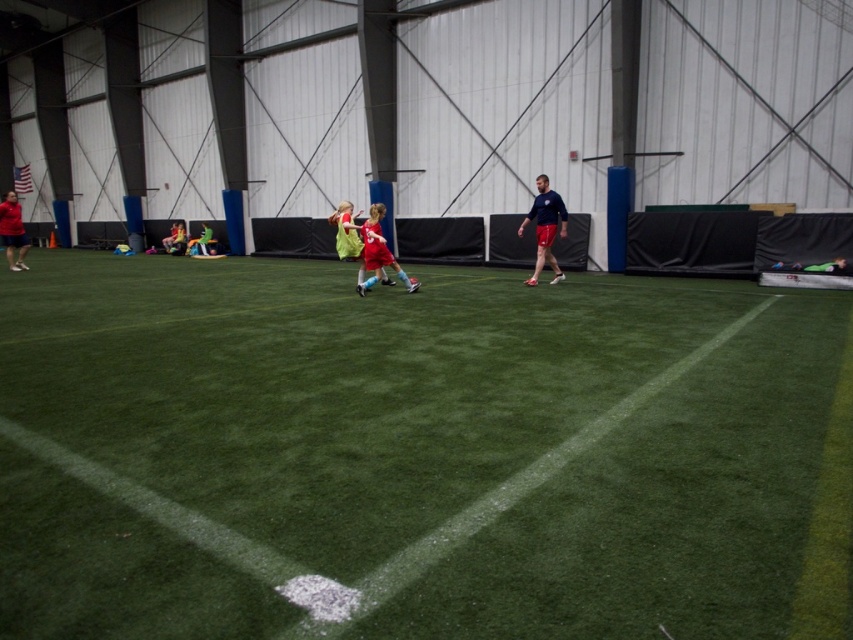
You are a photographer positioned at the edge of the soccer field. You want to take a photo that includes both the green artificial turf at center and the matte red shorts at left. Which object will appear larger in your photo?

The green artificial turf at center will appear larger in the photo because it is closer to the viewer than the matte red shorts at left.

You are a photographer standing at the edge of the indoor soccer field. You want to take a photo that includes both the point at [537,268] and the point at [368,241]. Which point should you focus on first to ensure both are in sharp focus?

You should focus on the point at [368,241] first because it is closer to the camera than the point at [537,268]. This ensures that both points will be in focus as the camera adjusts for the closer object.

You are a photographer positioned at the back of the indoor soccer field. You want to take a photo that includes both the shiny red shorts at center and the matte red shorts at left. Which pair of shorts will appear smaller in the final photo?

The shiny red shorts at center will appear smaller in the photo because it is not as tall as the matte red shorts at left, meaning it is closer to the camera, making it appear smaller.